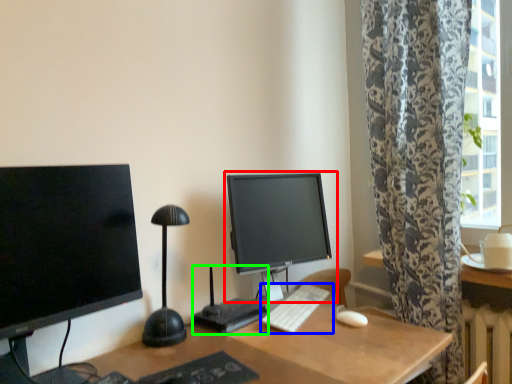
Question: Based on their relative distances, which object is nearer to computer monitor (highlighted by a red box)? Choose from computer keyboard (highlighted by a blue box) and computer desk (highlighted by a green box).

Choices:
 (A) computer keyboard
 (B) computer desk

Answer: (A)